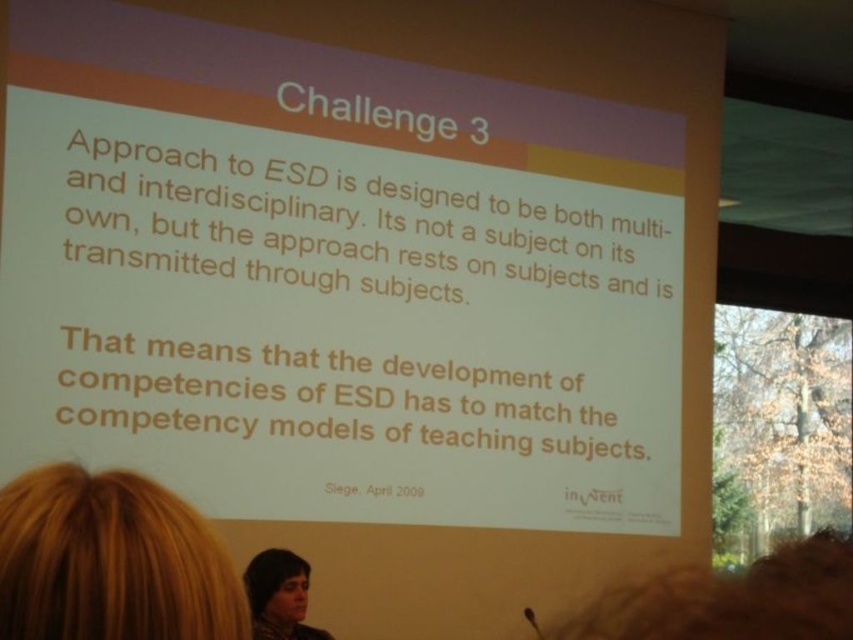
Question: Which of the following is the farthest from the observer?

Choices:
 (A) (277, 611)
 (B) (165, 579)

Answer: (A)

Question: Can you confirm if blonde hair at lower left is smaller than dark brown hair at lower center?

Choices:
 (A) no
 (B) yes

Answer: (B)

Question: Which object is closer to the camera taking this photo?

Choices:
 (A) dark brown hair at lower center
 (B) blonde hair at lower left

Answer: (B)

Question: Does blonde hair at lower left have a lesser width compared to dark brown hair at lower center?

Choices:
 (A) yes
 (B) no

Answer: (A)

Question: Does blonde hair at lower left have a larger size compared to dark brown hair at lower center?

Choices:
 (A) yes
 (B) no

Answer: (B)